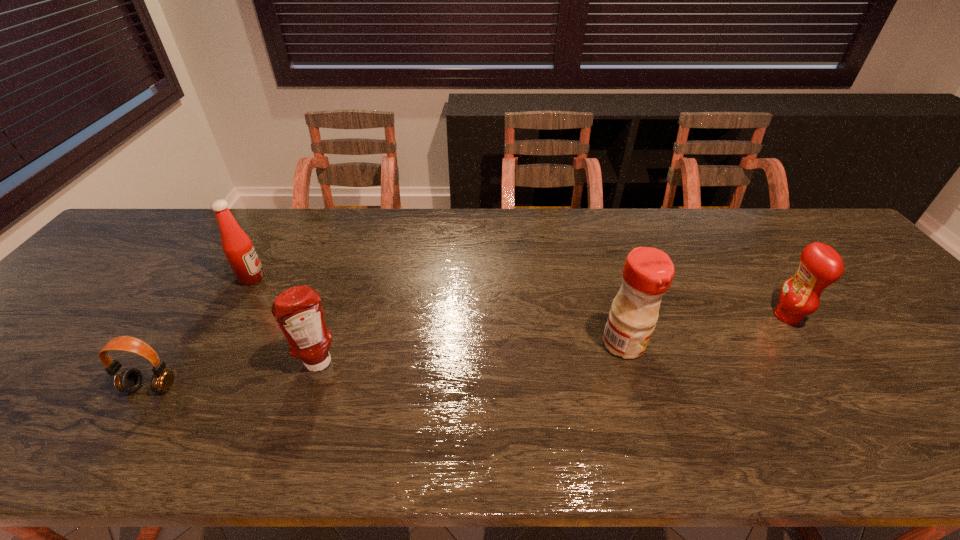
Locate an element on the screen. free location that satisfies the following two spatial constraints: 1. on the front-facing side of the third condiment from right to left; 2. on the left side of the farthest condiment is located at coordinates (203, 363).

Where is `vacant area that satisfies the following two spatial constraints: 1. on the front-facing side of the farthest condiment; 2. on the back side of the third condiment from left to right`? vacant area that satisfies the following two spatial constraints: 1. on the front-facing side of the farthest condiment; 2. on the back side of the third condiment from left to right is located at coordinates (214, 344).

At what (x,y) coordinates should I click in order to perform the action: click on vacant region that satisfies the following two spatial constraints: 1. on the front-facing side of the farthest condiment; 2. on the right side of the second condiment from right to left. Please return your answer as a coordinate pair (x, y). This screenshot has height=540, width=960. Looking at the image, I should click on (214, 344).

Where is `vacant space that satisfies the following two spatial constraints: 1. on the label side of the rightmost object; 2. on the front side of the third condiment from left to right`? vacant space that satisfies the following two spatial constraints: 1. on the label side of the rightmost object; 2. on the front side of the third condiment from left to right is located at coordinates (806, 344).

Where is `vacant area in the image that satisfies the following two spatial constraints: 1. on the front-facing side of the leftmost condiment; 2. on the back side of the third object from right to left`? vacant area in the image that satisfies the following two spatial constraints: 1. on the front-facing side of the leftmost condiment; 2. on the back side of the third object from right to left is located at coordinates (203, 363).

I want to click on vacant area in the image that satisfies the following two spatial constraints: 1. on the label side of the rightmost object; 2. on the ear cups of the shortest object, so click(x=836, y=387).

Locate an element on the screen. This screenshot has width=960, height=540. vacant point that satisfies the following two spatial constraints: 1. on the back side of the second object from right to left; 2. on the right side of the third object from right to left is located at coordinates (326, 344).

What are the coordinates of `vacant area in the image that satisfies the following two spatial constraints: 1. on the front-facing side of the farthest object; 2. on the right side of the third condiment from left to right` in the screenshot? It's located at (214, 344).